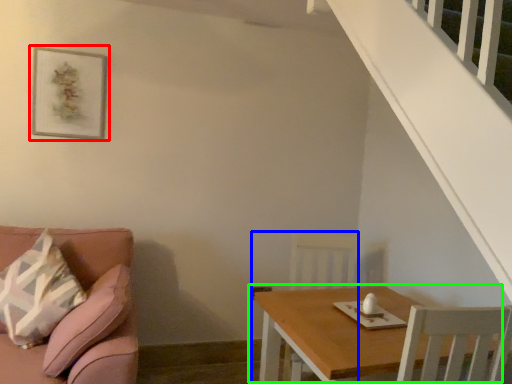
Question: Based on their relative distances, which object is nearer to picture frame (highlighted by a red box)? Choose from armchair (highlighted by a blue box) and table (highlighted by a green box).

Choices:
 (A) armchair
 (B) table

Answer: (A)